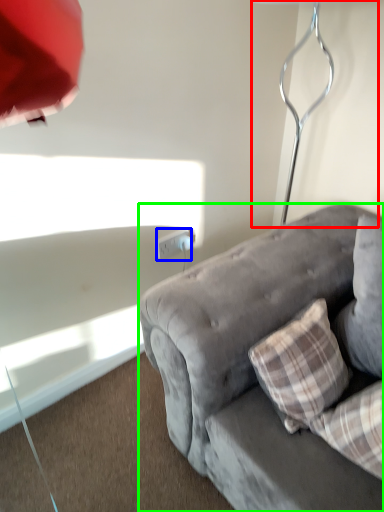
Question: Considering the real-world distances, which object is closest to table lamp (highlighted by a red box)? power outlet (highlighted by a blue box) or studio couch (highlighted by a green box).

Choices:
 (A) power outlet
 (B) studio couch

Answer: (B)